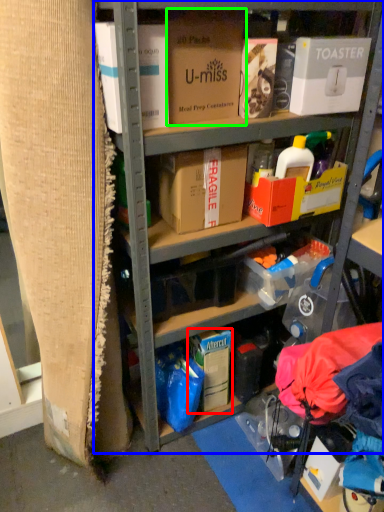
Question: Which is farther away from storage box (highlighted by a red box)? shelf (highlighted by a blue box) or box (highlighted by a green box)?

Choices:
 (A) shelf
 (B) box

Answer: (B)